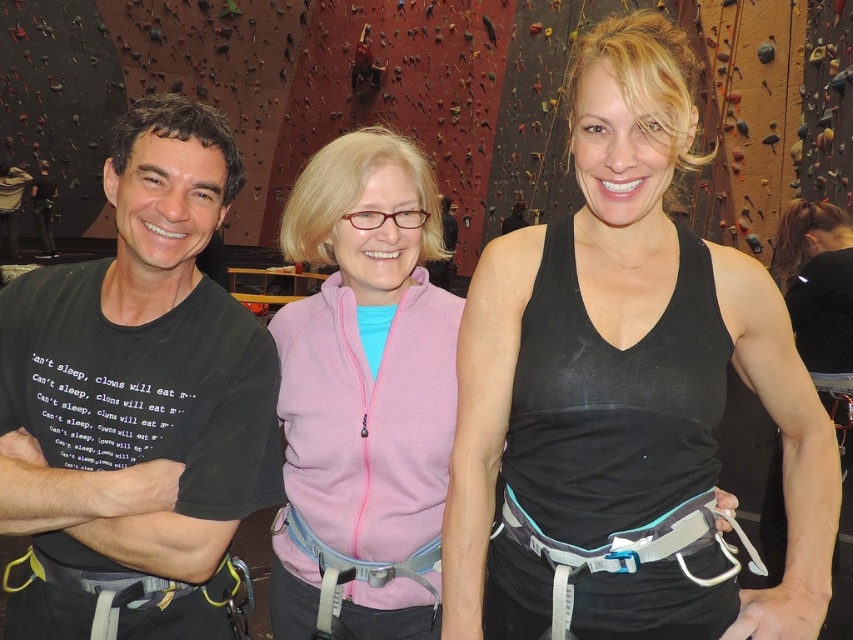
You are a photographer standing in front of the climbing wall. You need to take a photo of the black matte tank top at center and the pink fleece jacket at center. The minimum distance between the two objects in the photo should be 20 inches. Will the current positioning allow you to achieve this?

The black matte tank top at center is 20.22 inches from the pink fleece jacket at center. Since 20.22 inches is slightly more than the required 20 inches minimum distance, the current positioning allows the photographer to take the photo with the required minimum distance between the two objects.

Where is the black matte tank top at center located in the image?

The black matte tank top at center is located at point (624, 380) in the image.